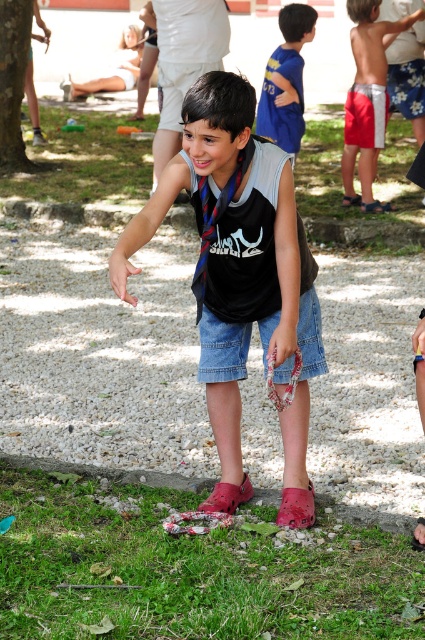
Question: Is the position of green grass at lower left more distant than that of pink croc sandal at lower center?

Choices:
 (A) yes
 (B) no

Answer: (B)

Question: Estimate the real-world distances between objects in this image. Which object is farther from the red fabric sandal at lower center?

Choices:
 (A) red cotton shorts at center
 (B) green grass at lower left
 (C) brown leather sandal at center
 (D) reddish-brown leather sandal at lower center

Answer: (B)

Question: Is floral fabric sandal at lower center below red fabric sandal at lower center?

Choices:
 (A) yes
 (B) no

Answer: (A)

Question: Among these objects, which one is farthest from the camera?

Choices:
 (A) black cotton shirt at center
 (B) reddish-brown leather sandal at lower center

Answer: (B)

Question: Which object is positioned farthest from the red cotton shorts at center?

Choices:
 (A) green grass at lower left
 (B) red fabric sandal at lower center
 (C) blue jersey at upper center

Answer: (A)

Question: Where is green grass at lower left located in relation to red cotton shorts at center in the image?

Choices:
 (A) left
 (B) right

Answer: (A)